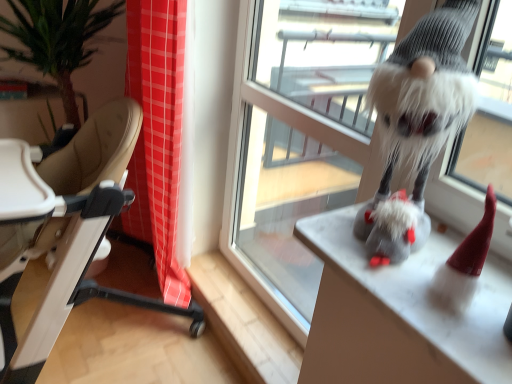
Question: Can you confirm if fuzzy gray gnome at right is wider than transparent glass window at center?

Choices:
 (A) yes
 (B) no

Answer: (A)

Question: Is fuzzy gray gnome at right thinner than transparent glass window at center?

Choices:
 (A) yes
 (B) no

Answer: (B)

Question: From the image's perspective, is fuzzy gray gnome at right beneath transparent glass window at center?

Choices:
 (A) yes
 (B) no

Answer: (A)

Question: Is fuzzy gray gnome at right not within transparent glass window at center?

Choices:
 (A) no
 (B) yes

Answer: (B)

Question: Is fuzzy gray gnome at right at the right side of transparent glass window at center?

Choices:
 (A) no
 (B) yes

Answer: (B)

Question: From a real-world perspective, is fuzzy gray gnome at upper right positioned above or below transparent glass window at center?

Choices:
 (A) below
 (B) above

Answer: (B)

Question: Is fuzzy gray gnome at upper right bigger or smaller than transparent glass window at center?

Choices:
 (A) big
 (B) small

Answer: (B)

Question: Choose the correct answer: Is fuzzy gray gnome at upper right inside transparent glass window at center or outside it?

Choices:
 (A) inside
 (B) outside

Answer: (B)

Question: Based on their positions, is fuzzy gray gnome at upper right located to the left or right of transparent glass window at center?

Choices:
 (A) left
 (B) right

Answer: (B)

Question: Considering the positions of point (125, 299) and point (345, 279), is point (125, 299) closer or farther from the camera than point (345, 279)?

Choices:
 (A) closer
 (B) farther

Answer: (B)

Question: Visually, is beige leather highchair at left positioned to the left or to the right of fuzzy gray gnome at right?

Choices:
 (A) right
 (B) left

Answer: (B)

Question: From the image's perspective, is beige leather highchair at left positioned above or below fuzzy gray gnome at right?

Choices:
 (A) above
 (B) below

Answer: (A)

Question: From a real-world perspective, relative to fuzzy gray gnome at right, is beige leather highchair at left vertically above or below?

Choices:
 (A) below
 (B) above

Answer: (A)

Question: Considering the positions of fuzzy gray gnome at right and transparent glass window at center in the image, is fuzzy gray gnome at right wider or thinner than transparent glass window at center?

Choices:
 (A) wide
 (B) thin

Answer: (A)

Question: From a real-world perspective, relative to transparent glass window at center, is fuzzy gray gnome at right vertically above or below?

Choices:
 (A) above
 (B) below

Answer: (A)